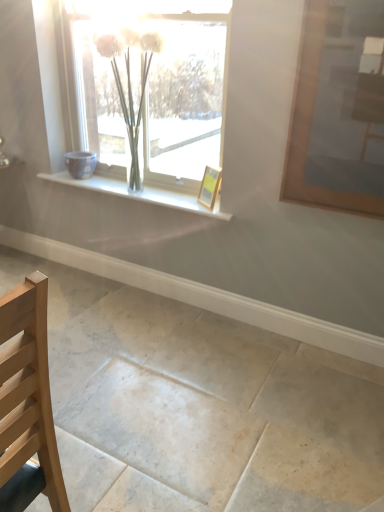
You are a GUI agent. You are given a task and a screenshot of the screen. Output one action in this format:
    pyautogui.click(x=<x>, y=<y>)
    Task: Click on the blank space situated above smooth stone floor at center (from a real-world perspective)
    This screenshot has width=384, height=512.
    Given the screenshot: What is the action you would take?
    pyautogui.click(x=154, y=386)